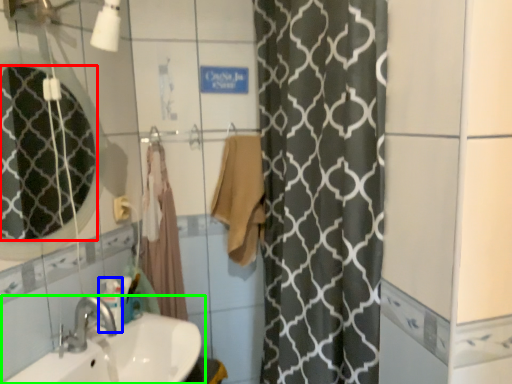
Question: Estimate the real-world distances between objects in this image. Which object is farther from mirror (highlighted by a red box), toiletry (highlighted by a blue box) or sink (highlighted by a green box)?

Choices:
 (A) toiletry
 (B) sink

Answer: (B)